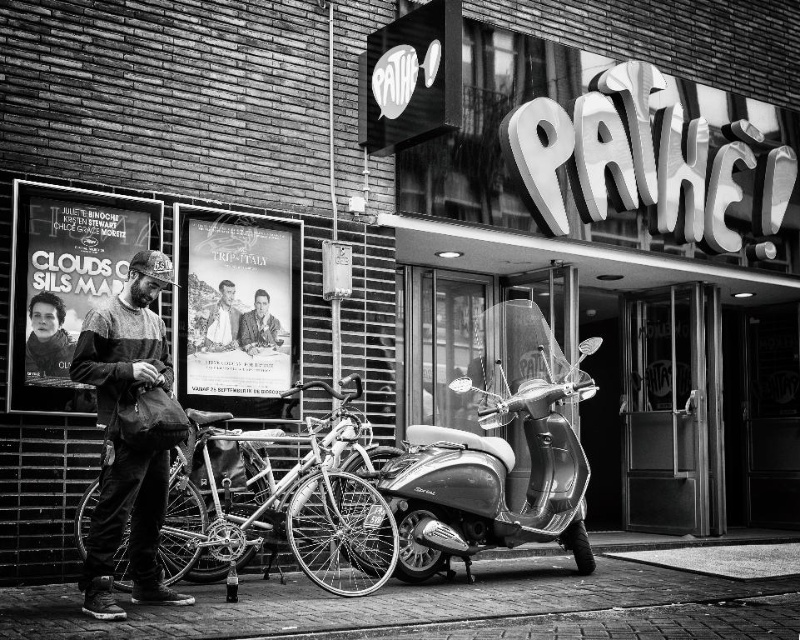
Who is more forward, [454,499] or [242,330]?

Point [454,499] is in front.

Can you confirm if shiny chrome scooter at center is positioned below smooth skin face at center?

Yes, shiny chrome scooter at center is below smooth skin face at center.

Is point (478, 497) farther from viewer compared to point (250, 333)?

No, (478, 497) is closer to viewer.

Where is `shiny chrome scooter at center`? The width and height of the screenshot is (800, 640). shiny chrome scooter at center is located at coordinates (496, 456).

Find the location of a particular element. The width and height of the screenshot is (800, 640). dark gray sweater at left is located at coordinates (128, 435).

Can you confirm if dark gray sweater at left is smaller than matte black poster at left?

Actually, dark gray sweater at left might be larger than matte black poster at left.

Which is in front, point (130, 522) or point (36, 412)?

Point (130, 522) is in front.

Locate an element on the screen. The height and width of the screenshot is (640, 800). dark gray sweater at left is located at coordinates (128, 435).

Does shiny silver bicycle at center appear on the left side of smooth leather jacket at center?

Incorrect, shiny silver bicycle at center is not on the left side of smooth leather jacket at center.

Does shiny silver bicycle at center appear on the right side of smooth leather jacket at center?

Yes, shiny silver bicycle at center is to the right of smooth leather jacket at center.

What are the coordinates of `shiny silver bicycle at center` in the screenshot? It's located at (284, 504).

At what (x,y) coordinates should I click in order to perform the action: click on shiny silver bicycle at center. Please return your answer as a coordinate pair (x, y). Looking at the image, I should click on (284, 504).